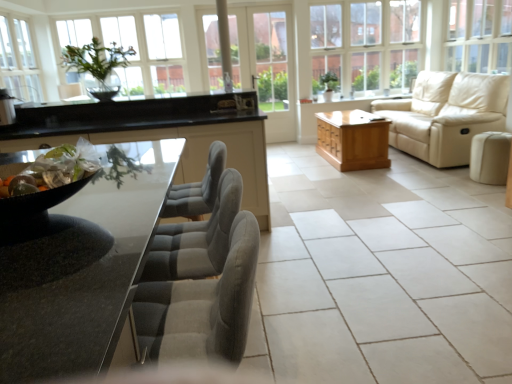
Question: From the image's perspective, relative to clear glass window at upper right, the third window from the left, is velvet grey chair at center above or below?

Choices:
 (A) below
 (B) above

Answer: (A)

Question: Is point (176, 289) positioned closer to the camera than point (487, 56)?

Choices:
 (A) farther
 (B) closer

Answer: (B)

Question: Considering the real-world distances, which object is closest to the beige leather couch at right?

Choices:
 (A) clear glass window at upper center, arranged as the 2th window when viewed from the left
 (B) light brown wooden cabinet at center
 (C) white ceramic tile at center
 (D) shiny metallic bowl of fruits at left, placed as the first food when sorted from back to front
 (E) green leafy plant at upper left

Answer: (B)

Question: Estimate the real-world distances between objects in this image. Which object is farther from the black glossy table at left?

Choices:
 (A) clear glass window at upper center, arranged as the 2th window when viewed from the left
 (B) velvet grey chair at center
 (C) green leafy plant at upper left
 (D) clear glass vase at upper center, marked as the first window in a left-to-right arrangement
 (E) beige leather couch at right

Answer: (A)